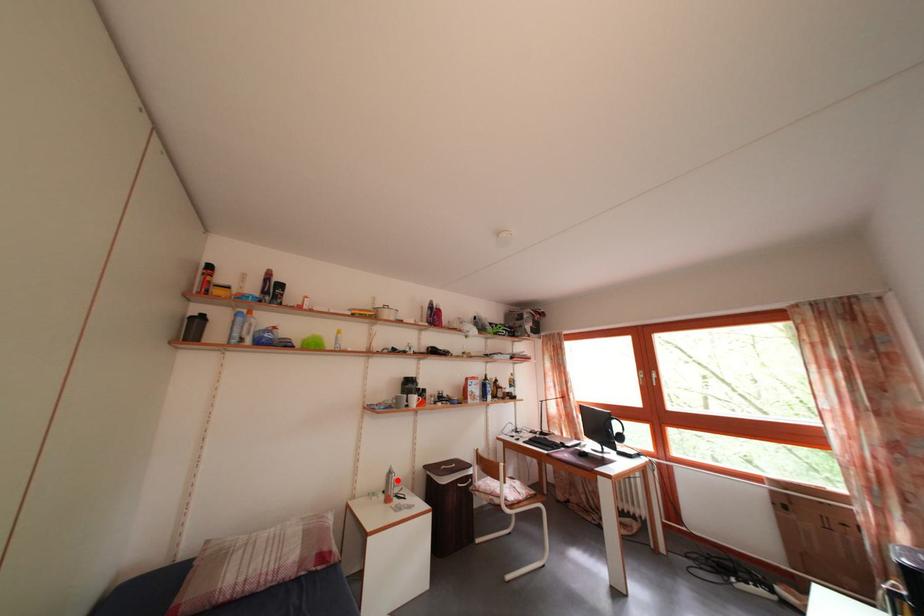
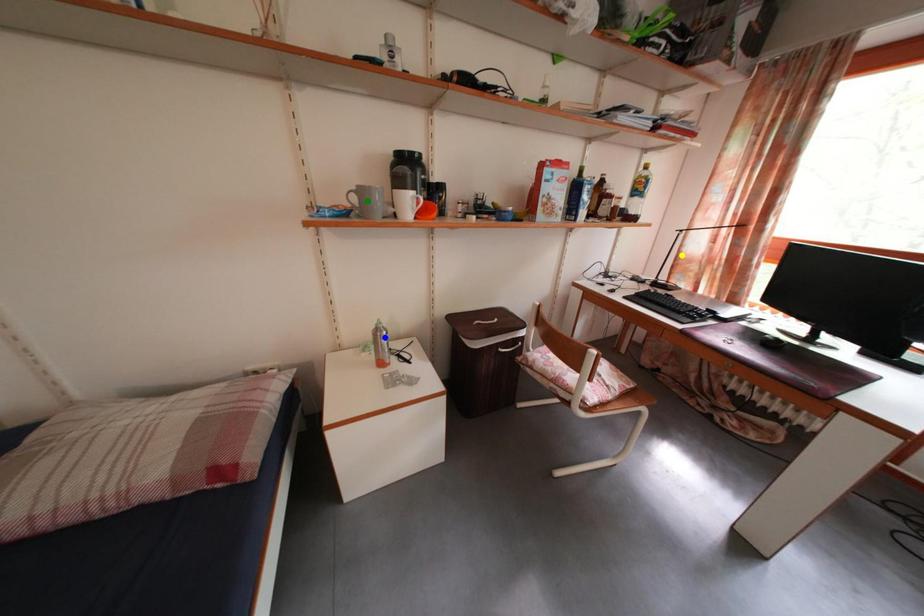
Question: I am providing you with two images of the same scene from different viewpoints. A red point is marked on the first image. You are given multiple points on the second image. Which spot in image 2 lines up with the point in image 1?

Choices:
 (A) blue point
 (B) green point
 (C) yellow point

Answer: (A)